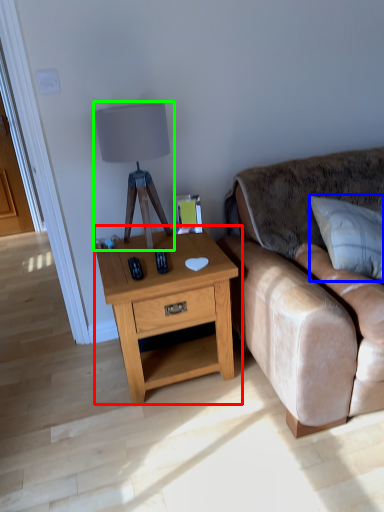
Question: Based on their relative distances, which object is nearer to nightstand (highlighted by a red box)? Choose from pillow (highlighted by a blue box) and table lamp (highlighted by a green box).

Choices:
 (A) pillow
 (B) table lamp

Answer: (B)